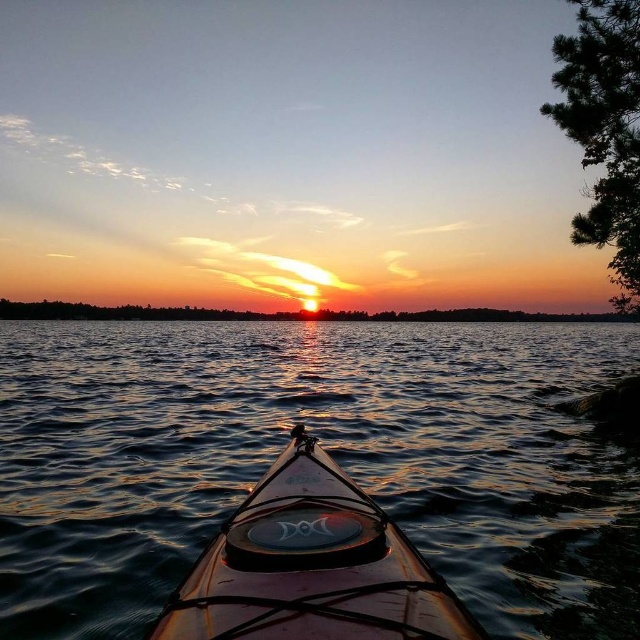
Looking at this image, which is below, glossy water at center or translucent brown canoe at center?

glossy water at center is below.

Is glossy water at center below translucent brown canoe at center?

Indeed, glossy water at center is positioned under translucent brown canoe at center.

The height and width of the screenshot is (640, 640). Identify the location of glossy water at center. (324, 449).

Who is shorter, translucent brown canoe at center or smooth orange sky at center?

Standing shorter between the two is translucent brown canoe at center.

Who is lower down, translucent brown canoe at center or smooth orange sky at center?

translucent brown canoe at center

I want to click on translucent brown canoe at center, so click(310, 566).

Does glossy water at center have a smaller size compared to smooth orange sky at center?

Yes.

Who is more forward, [525,392] or [28,308]?

Point [525,392]

Where is `glossy water at center`? This screenshot has width=640, height=640. glossy water at center is located at coordinates (324, 449).